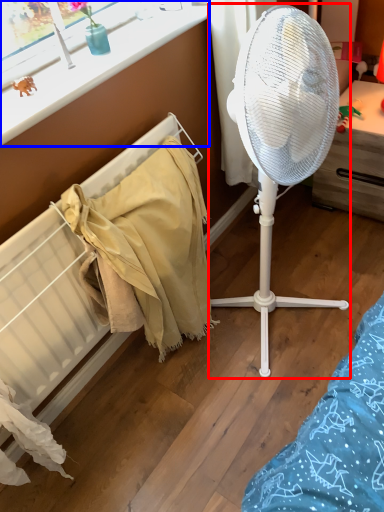
Question: Among these objects, which one is farthest to the camera, mechanical fan (highlighted by a red box) or window frame (highlighted by a blue box)?

Choices:
 (A) mechanical fan
 (B) window frame

Answer: (B)